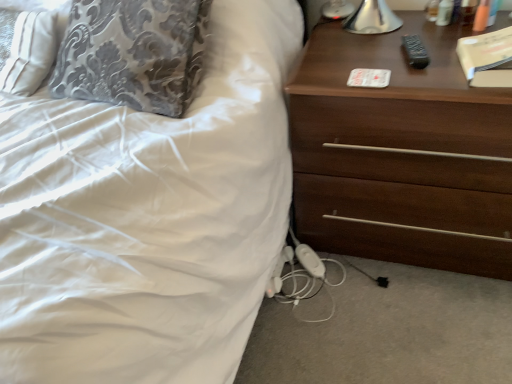
Identify the location of free spot above dark brown wood chest of drawers at right (from a real-world perspective). The height and width of the screenshot is (384, 512). (401, 48).